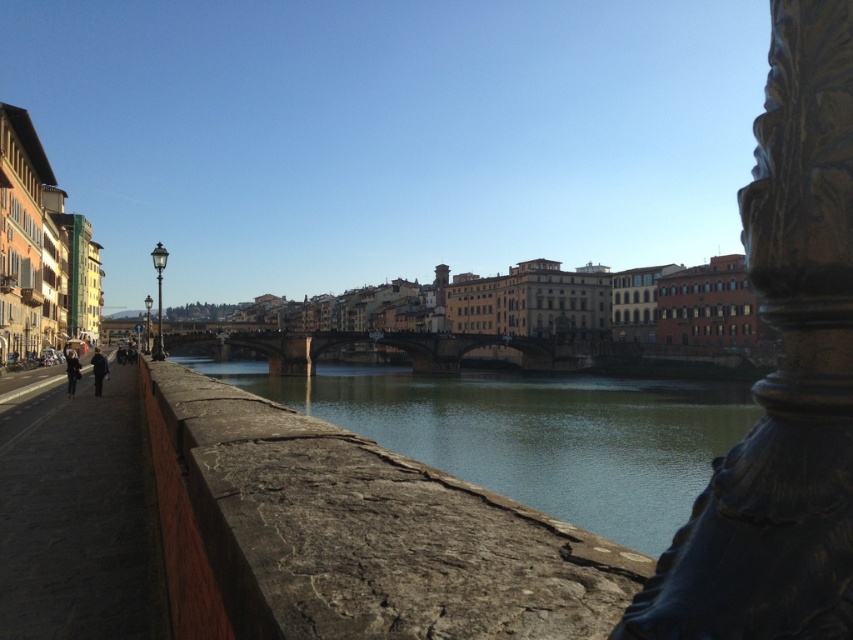
You are a tourist standing on the stone bridge at center, looking down at the green stone river at center. Which object is higher in elevation?

The stone bridge at center is higher in elevation than the green stone river at center because the river is much taller as the bridge.